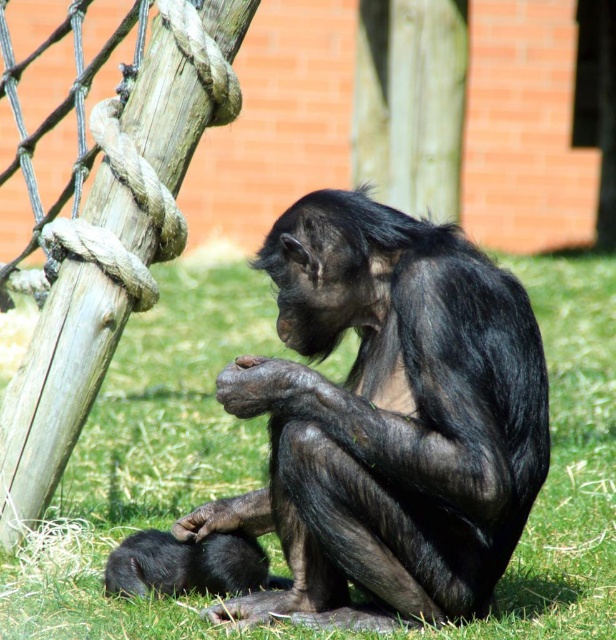
You are a zookeeper observing two chimpanzees in their enclosure. You notice a shiny black monkey at center and a shiny black monkey at lower left. Which chimpanzee is taller?

The shiny black monkey at center is taller than the shiny black monkey at lower left.

You are a zookeeper observing the chimpanzees in their enclosure. You notice two shiny black monkey at center and shiny black monkey at lower left. Which one is bigger?

The shiny black monkey at center is larger in size compared to the shiny black monkey at lower left.

You are a zookeeper observing a chimpanzee in its enclosure. You notice a specific point marked at coordinates (387, 417). Based on the scene, where is this point located on the chimpanzee?

The point at (387, 417) is located on the shiny black monkey at center.